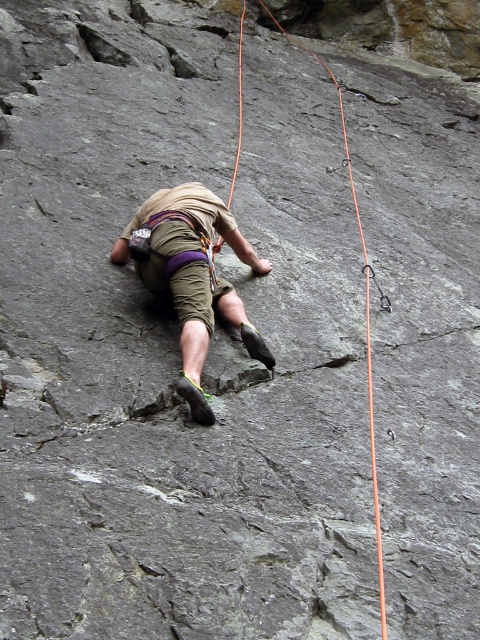
Is khaki cotton shorts at center shorter than orange nylon rope at upper center?

Yes.

The image size is (480, 640). What do you see at coordinates (192, 275) in the screenshot?
I see `khaki cotton shorts at center` at bounding box center [192, 275].

Is point (155, 268) in front of point (369, 323)?

Yes, it is in front of point (369, 323).

Where is `khaki cotton shorts at center`? The image size is (480, 640). khaki cotton shorts at center is located at coordinates (192, 275).